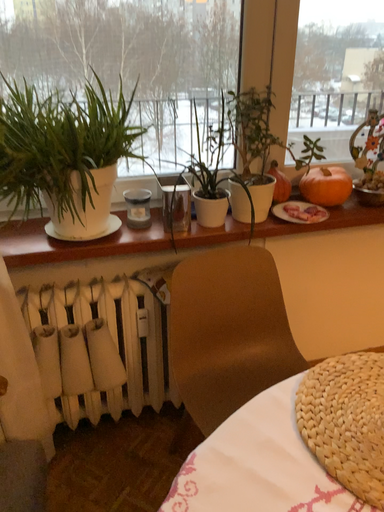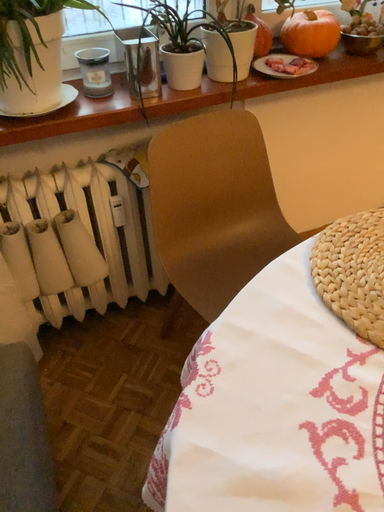
Question: Which way did the camera rotate in the video?

Choices:
 (A) rotated downward
 (B) rotated upward

Answer: (A)